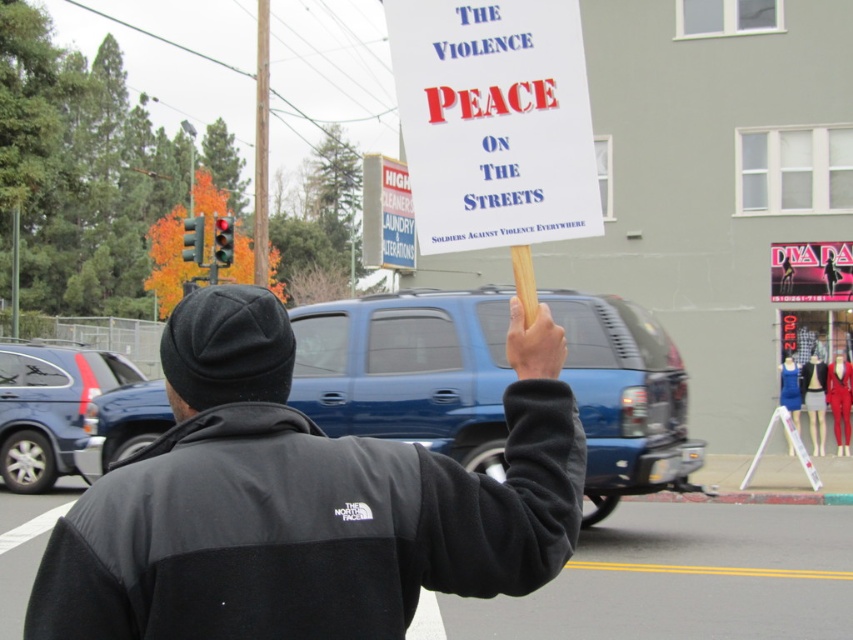
You are a pedestrian trying to read the sign held by the person in the street scene. Which object is positioned higher up in the image, the black fleece jacket at center or the white paper sign at upper center?

The white paper sign at upper center is positioned higher up in the image than the black fleece jacket at center.

You are a photographer trying to capture a clear shot of the black fleece jacket at center and the matte blue suv at center in the street scene. Which object should you zoom in on to ensure it takes up more space in your photo?

The matte blue suv at center is larger than the black fleece jacket at center, so you should zoom in on the matte blue suv at center to ensure it takes up more space in your photo.